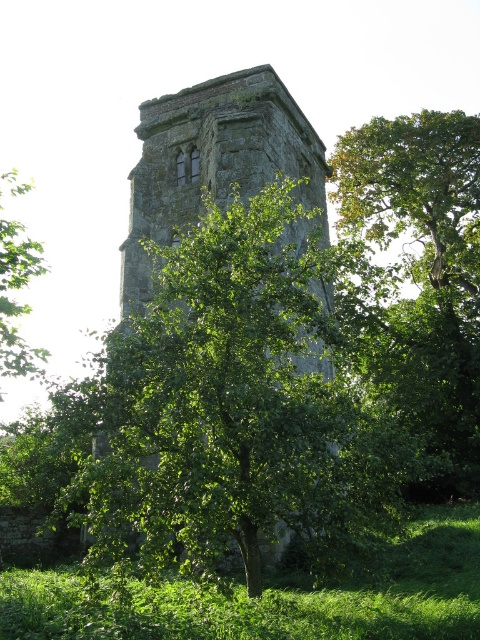
Can you confirm if green leafy tree at center is wider than green leafy tree at left?

Indeed, green leafy tree at center has a greater width compared to green leafy tree at left.

Describe the element at coordinates (420, 282) in the screenshot. This screenshot has height=640, width=480. I see `green leafy tree at center` at that location.

Who is more distant from viewer, (431, 243) or (0, 244)?

Positioned behind is point (431, 243).

Identify the location of green leafy tree at center. The image size is (480, 640). (420, 282).

Consider the image. Can you confirm if stone tower at center is positioned to the left of green leafy tree at left?

In fact, stone tower at center is to the right of green leafy tree at left.

Which is behind, point (263, 173) or point (3, 241)?

The point (3, 241) is behind.

I want to click on stone tower at center, so pyautogui.click(x=216, y=164).

Does green leafy tree at center have a greater height compared to stone tower at center?

Correct, green leafy tree at center is much taller as stone tower at center.

Is point (395, 150) closer to camera compared to point (106, 451)?

No.

Locate an element on the screen. The image size is (480, 640). green leafy tree at center is located at coordinates (420, 282).